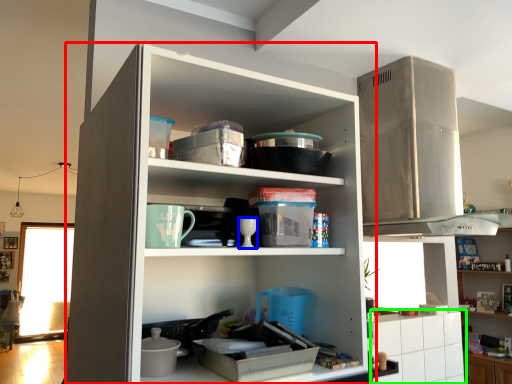
Question: Which is farther away from cupboard (highlighted by a red box)? tableware (highlighted by a blue box) or cabinetry (highlighted by a green box)?

Choices:
 (A) tableware
 (B) cabinetry

Answer: (B)